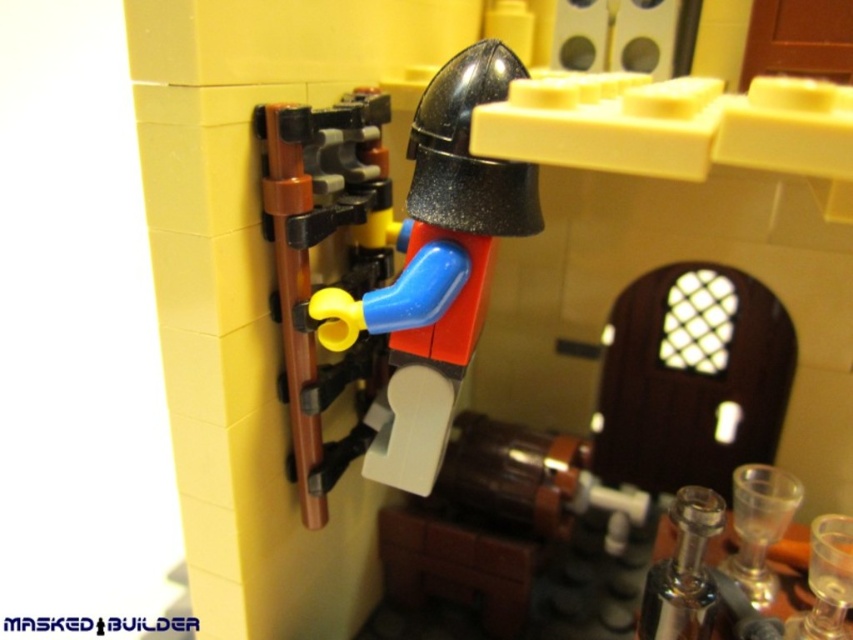
You are a LEGO builder who wants to adjust the lever on the catapult. You have the matte black helmet at center and the yellow matte lever at center in your view. Which object is closer to the right edge of the catapult mechanism?

The matte black helmet at center is positioned on the right side of the yellow matte lever at center, so the matte black helmet at center is closer to the right edge of the catapult mechanism.

You are a LEGO architect designing a medieval scene. You have two objects in front of you, the matte black helmet at center and the yellow matte lever at center. Which object should you place closer to the catapult mechanism to ensure proper scale? Please explain your reasoning.

The matte black helmet at center is larger in size than the yellow matte lever at center. Therefore, to maintain proper scale, the smaller yellow matte lever at center should be placed closer to the catapult mechanism since it is more appropriately sized for the mechanism compared to the larger helmet.

You are a LEGO builder examining the medieval diorama. You notice the matte black helmet at center and the yellow matte lever at center. Which object is placed higher in the scene?

The matte black helmet at center is positioned over the yellow matte lever at center, so it is higher in the scene.